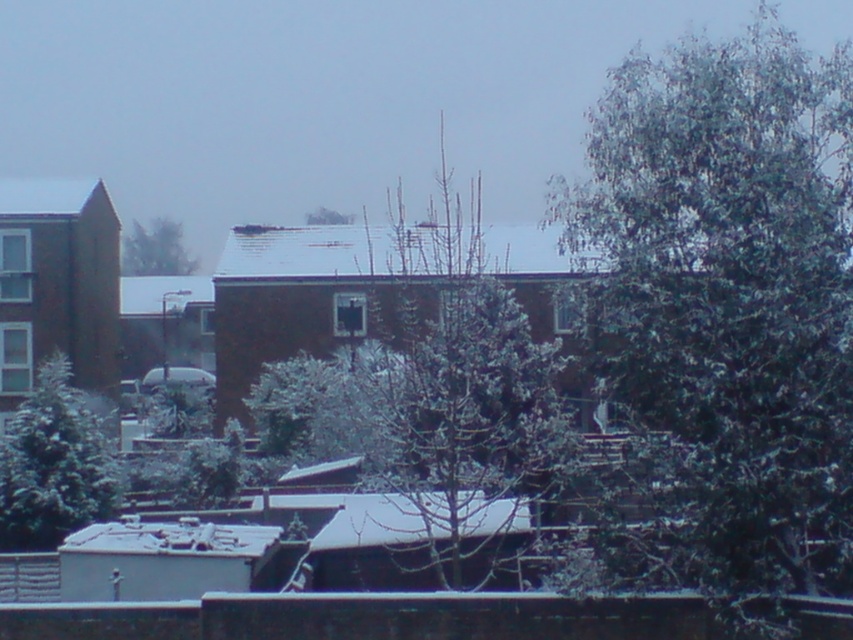
Question: Among these objects, which one is farthest from the camera?

Choices:
 (A) white fluffy tree at right
 (B) snowy evergreen tree at upper left

Answer: (B)

Question: Which point is farther to the camera?

Choices:
 (A) snow-covered tree at center
 (B) snowy evergreen tree at upper left
 (C) white fluffy tree at right

Answer: (B)

Question: Is white fluffy tree at right to the right of green frosted tree at lower left from the viewer's perspective?

Choices:
 (A) yes
 (B) no

Answer: (A)

Question: Among these points, which one is farthest from the camera?

Choices:
 (A) [x=109, y=445]
 (B) [x=328, y=211]

Answer: (B)

Question: Does white fluffy tree at right appear over green frosted tree at center?

Choices:
 (A) no
 (B) yes

Answer: (B)

Question: Can you confirm if white fluffy tree at right is wider than green frosted tree at center?

Choices:
 (A) no
 (B) yes

Answer: (B)